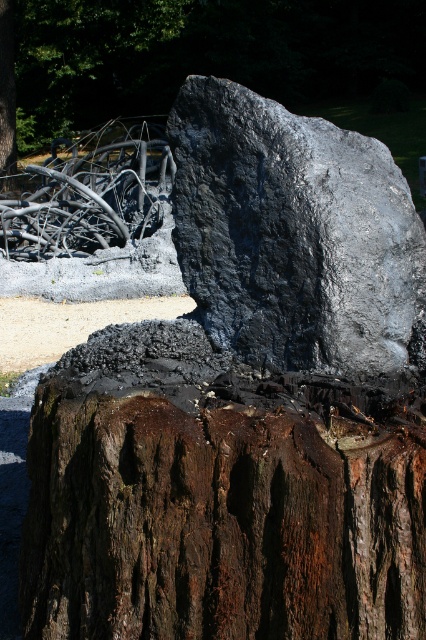
Based on the scene description, what object is located at the coordinates point (221, 522)?

The object at point (221, 522) is the rusty wood tree trunk at center.

You are standing at the point marked as point [221,522] in the image. What object is exactly at this location?

The rusty wood tree trunk at center is exactly at point [221,522].

You are a hiker who wants to place a 40 feet long tent between the black polished rock at center and the brown rough tree trunk at center. Can you fit the tent between them without overlapping either object?

The distance between the black polished rock at center and the brown rough tree trunk at center is 43.86 feet. Since the tent is 40 feet long, it can fit between them with 3.86 feet of space remaining on either side.